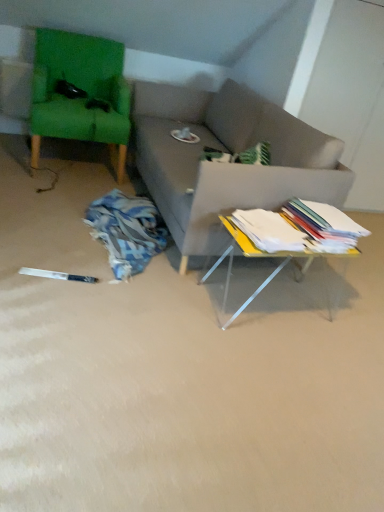
At what (x,y) coordinates should I click in order to perform the action: click on vacant point to the right of yellow acrylic table at lower right. Please return your answer as a coordinate pair (x, y). The image size is (384, 512). Looking at the image, I should click on (355, 318).